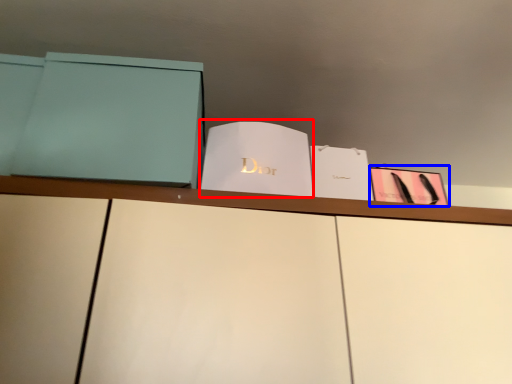
Question: Which object appears farthest to the camera in this image, paperback book (highlighted by a red box) or paperback book (highlighted by a blue box)?

Choices:
 (A) paperback book
 (B) paperback book

Answer: (B)